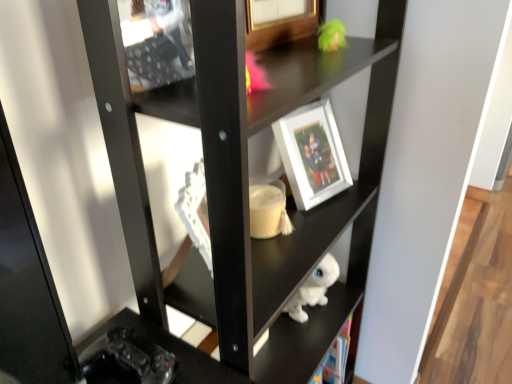
The height and width of the screenshot is (384, 512). Find the location of `white matte picture frame at center`. white matte picture frame at center is located at coordinates (312, 154).

The height and width of the screenshot is (384, 512). What do you see at coordinates (312, 154) in the screenshot?
I see `white matte picture frame at center` at bounding box center [312, 154].

This screenshot has width=512, height=384. I want to click on white glossy statue at lower center, so click(x=242, y=181).

What do you see at coordinates (242, 181) in the screenshot? The height and width of the screenshot is (384, 512). I see `white glossy statue at lower center` at bounding box center [242, 181].

This screenshot has width=512, height=384. Identify the location of white matte picture frame at center. (312, 154).

Which object is positioned more to the left, white matte picture frame at center or white glossy statue at lower center?

From the viewer's perspective, white glossy statue at lower center appears more on the left side.

Relative to white glossy statue at lower center, is white matte picture frame at center in front or behind?

Visually, white matte picture frame at center is located behind white glossy statue at lower center.

Considering the points (326, 180) and (380, 126), which point is behind, point (326, 180) or point (380, 126)?

Positioned behind is point (326, 180).

From the image's perspective, is white matte picture frame at center under white glossy statue at lower center?

No.

From a real-world perspective, is white matte picture frame at center located higher than white glossy statue at lower center?

Yes, from a real-world perspective, white matte picture frame at center is on top of white glossy statue at lower center.

Considering the sizes of white matte picture frame at center and white glossy statue at lower center in the image, is white matte picture frame at center wider or thinner than white glossy statue at lower center?

Clearly, white matte picture frame at center has less width compared to white glossy statue at lower center.

Does white matte picture frame at center have a greater height compared to white glossy statue at lower center?

Incorrect, the height of white matte picture frame at center is not larger of that of white glossy statue at lower center.

In terms of size, does white matte picture frame at center appear bigger or smaller than white glossy statue at lower center?

white matte picture frame at center is smaller than white glossy statue at lower center.

Is white matte picture frame at center positioned beyond the bounds of white glossy statue at lower center?

No, most part of white matte picture frame at center lies within white glossy statue at lower center.

Is white matte picture frame at center in contact with white glossy statue at lower center?

No, white matte picture frame at center is not with white glossy statue at lower center.

Is white matte picture frame at center oriented towards white glossy statue at lower center?

Yes, white matte picture frame at center is oriented towards white glossy statue at lower center.

How far apart are white matte picture frame at center and white glossy statue at lower center?

The distance of white matte picture frame at center from white glossy statue at lower center is 8.71 inches.

The height and width of the screenshot is (384, 512). What are the coordinates of `shelf beneath the white matte picture frame at center (from a real-world perspective)` in the screenshot? It's located at (242, 181).

Which is more to the right, white glossy statue at lower center or white matte picture frame at center?

Positioned to the right is white matte picture frame at center.

Is white glossy statue at lower center in front of or behind white matte picture frame at center in the image?

Visually, white glossy statue at lower center is located in front of white matte picture frame at center.

Is point (239, 178) behind point (320, 190)?

No, (239, 178) is in front of (320, 190).

From the image's perspective, between white glossy statue at lower center and white matte picture frame at center, which one is located above?

white matte picture frame at center appears higher in the image.

From a real-world perspective, relative to white matte picture frame at center, is white glossy statue at lower center vertically above or below?

white glossy statue at lower center is below white matte picture frame at center.

Which of these two, white glossy statue at lower center or white matte picture frame at center, is thinner?

Thinner between the two is white matte picture frame at center.

Does white glossy statue at lower center have a greater height compared to white matte picture frame at center?

Yes, white glossy statue at lower center is taller than white matte picture frame at center.

Which of these two, white glossy statue at lower center or white matte picture frame at center, is bigger?

With larger size is white glossy statue at lower center.

Consider the image. Is white matte picture frame at center a part of white glossy statue at lower center?

Yes, white matte picture frame at center is a part of white glossy statue at lower center.

Is white glossy statue at lower center not close to white matte picture frame at center?

Actually, white glossy statue at lower center and white matte picture frame at center are a little close together.

Is white glossy statue at lower center oriented away from white matte picture frame at center?

Yes.

What's the angular difference between white glossy statue at lower center and white matte picture frame at center's facing directions?

The angle between the facing direction of white glossy statue at lower center and the facing direction of white matte picture frame at center is 12.5 degrees.

Where is `shelf in front of the white matte picture frame at center`? This screenshot has height=384, width=512. shelf in front of the white matte picture frame at center is located at coordinates click(x=242, y=181).

Image resolution: width=512 pixels, height=384 pixels. In order to click on picture frame that appears on the right of white glossy statue at lower center in this screenshot , I will do `click(312, 154)`.

The height and width of the screenshot is (384, 512). Identify the location of picture frame that appears above the white glossy statue at lower center (from a real-world perspective). (312, 154).